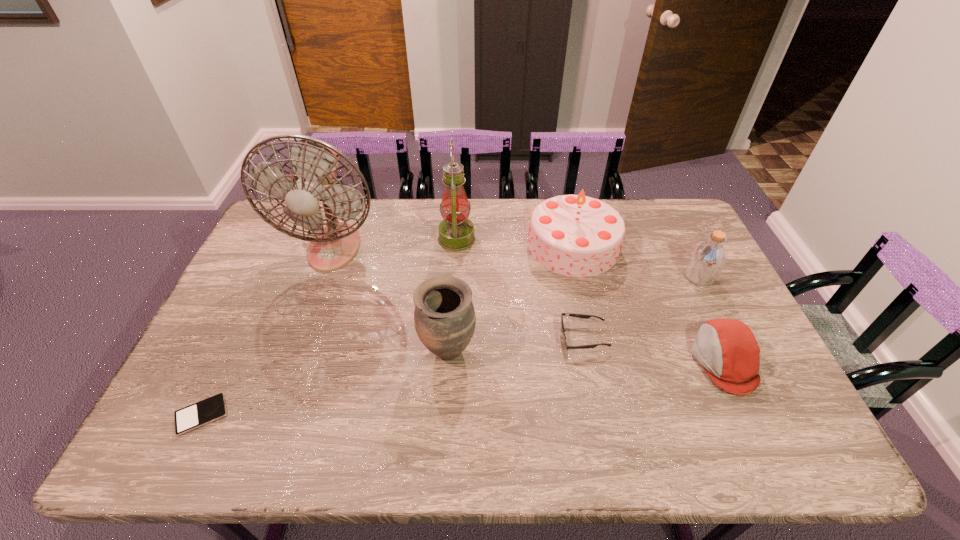
Locate an element on the screen. This screenshot has width=960, height=540. free space between the seventh shortest object and the tallest object is located at coordinates (396, 243).

You are a GUI agent. You are given a task and a screenshot of the screen. Output one action in this format:
    pyautogui.click(x=<x>, y=<y>)
    Task: Click on the object that is the second closest to the cap
    This screenshot has height=540, width=960.
    Given the screenshot: What is the action you would take?
    pyautogui.click(x=583, y=316)

Find the location of `the second closest object to the bottle`. the second closest object to the bottle is located at coordinates (573, 235).